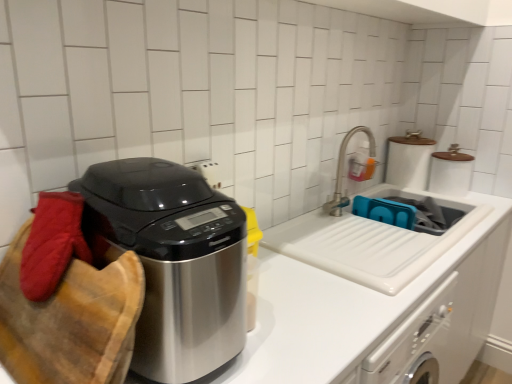
You are a GUI agent. You are given a task and a screenshot of the screen. Output one action in this format:
    pyautogui.click(x=<x>, y=<y>)
    Task: Click on the free point in front of brushed metal faucet at upper right
    This screenshot has height=384, width=512.
    Given the screenshot: What is the action you would take?
    pyautogui.click(x=378, y=225)